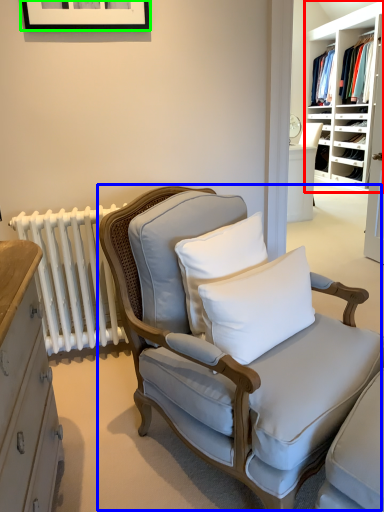
Question: Estimate the real-world distances between objects in this image. Which object is closer to shelf (highlighted by a red box), chair (highlighted by a blue box) or picture frame (highlighted by a green box)?

Choices:
 (A) chair
 (B) picture frame

Answer: (B)